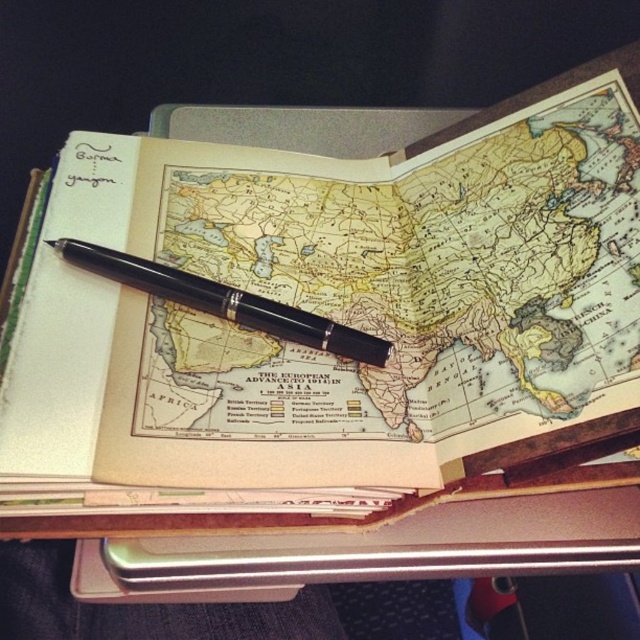
Between matte paper notebook at center and black polished pen at center, which one appears on the right side from the viewer's perspective?

From the viewer's perspective, matte paper notebook at center appears more on the right side.

Which is above, matte paper notebook at center or black polished pen at center?

matte paper notebook at center is higher up.

The width and height of the screenshot is (640, 640). Find the location of `matte paper notebook at center`. matte paper notebook at center is located at coordinates (330, 310).